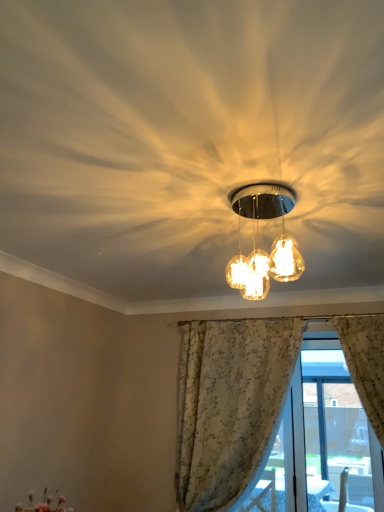
At what (x,y) coordinates should I click in order to perform the action: click on white floral curtain at lower right. Please return your answer as a coordinate pair (x, y). The height and width of the screenshot is (512, 384). Looking at the image, I should click on (295, 445).

The height and width of the screenshot is (512, 384). What are the coordinates of `matte glass globe at center` in the screenshot? It's located at (256, 238).

From the image's perspective, is white lace curtain at center positioned above or below white floral curtain at lower right?

From the image's perspective, white lace curtain at center appears above white floral curtain at lower right.

Which is behind, white lace curtain at center or white floral curtain at lower right?

Positioned behind is white floral curtain at lower right.

Is white lace curtain at center with white floral curtain at lower right?

No, white lace curtain at center is not touching white floral curtain at lower right.

What's the angular difference between white lace curtain at center and white floral curtain at lower right's facing directions?

0.377 degrees.

Is matte glass globe at center taller than white floral curtain at lower right?

In fact, matte glass globe at center may be shorter than white floral curtain at lower right.

Is point (283, 229) less distant than point (319, 341)?

That is True.

Measure the distance between matte glass globe at center and white floral curtain at lower right.

matte glass globe at center is 5.03 feet from white floral curtain at lower right.

Is white floral curtain at lower right looking in the opposite direction of white lace curtain at center?

That's not correct — white floral curtain at lower right is not looking away from white lace curtain at center.

Looking at their sizes, would you say white floral curtain at lower right is wider or thinner than white lace curtain at center?

Considering their sizes, white floral curtain at lower right looks slimmer than white lace curtain at center.

Does white floral curtain at lower right lie in front of white lace curtain at center?

No.

Considering the sizes of objects white floral curtain at lower right and white lace curtain at center in the image provided, who is taller, white floral curtain at lower right or white lace curtain at center?

Standing taller between the two is white lace curtain at center.

Is white floral curtain at lower right taller or shorter than matte glass globe at center?

Clearly, white floral curtain at lower right is taller compared to matte glass globe at center.

Are white floral curtain at lower right and matte glass globe at center far apart?

Yes.

Is white floral curtain at lower right aimed at matte glass globe at center?

Yes, white floral curtain at lower right faces towards matte glass globe at center.

From the image's perspective, would you say white lace curtain at center is positioned over matte glass globe at center?

No, from the image's perspective, white lace curtain at center is not on top of matte glass globe at center.

Is there a large distance between white lace curtain at center and matte glass globe at center?

white lace curtain at center is positioned a significant distance from matte glass globe at center.

Is white lace curtain at center turned away from matte glass globe at center?

No, white lace curtain at center's orientation is not away from matte glass globe at center.

Between white lace curtain at center and matte glass globe at center, which one is positioned behind?

Positioned behind is white lace curtain at center.

Can you confirm if matte glass globe at center is bigger than white lace curtain at center?

Incorrect, matte glass globe at center is not larger than white lace curtain at center.

Can you confirm if matte glass globe at center is thinner than white lace curtain at center?

Correct, the width of matte glass globe at center is less than that of white lace curtain at center.

Can you confirm if matte glass globe at center is positioned to the right of white lace curtain at center?

No, matte glass globe at center is not to the right of white lace curtain at center.

From a real-world perspective, is matte glass globe at center beneath white lace curtain at center?

Incorrect, from a real-world perspective, matte glass globe at center is higher than white lace curtain at center.

This screenshot has height=512, width=384. In order to click on curtain above the white floral curtain at lower right (from a real-world perspective) in this screenshot , I will do click(x=230, y=406).

Locate an element on the screen. window screen behind the matte glass globe at center is located at coordinates (295, 445).

Looking at the image, which one is located closer to white floral curtain at lower right, white lace curtain at center or matte glass globe at center?

Among the two, white lace curtain at center is located nearer to white floral curtain at lower right.

Considering their positions, is matte glass globe at center positioned closer to white lace curtain at center than white floral curtain at lower right?

white floral curtain at lower right is closer to white lace curtain at center.

From the image, which object appears to be farther from matte glass globe at center, white floral curtain at lower right or white lace curtain at center?

white floral curtain at lower right lies further to matte glass globe at center than the other object.

Which object lies further to the anchor point matte glass globe at center, white lace curtain at center or white floral curtain at lower right?

white floral curtain at lower right.

Estimate the real-world distances between objects in this image. Which object is further from white floral curtain at lower right, matte glass globe at center or white lace curtain at center?

Based on the image, matte glass globe at center appears to be further to white floral curtain at lower right.

Which object lies nearer to the anchor point white lace curtain at center, white floral curtain at lower right or matte glass globe at center?

white floral curtain at lower right is positioned closer to the anchor white lace curtain at center.

Identify the location of curtain between matte glass globe at center and white floral curtain at lower right in the vertical direction. pyautogui.click(x=230, y=406).